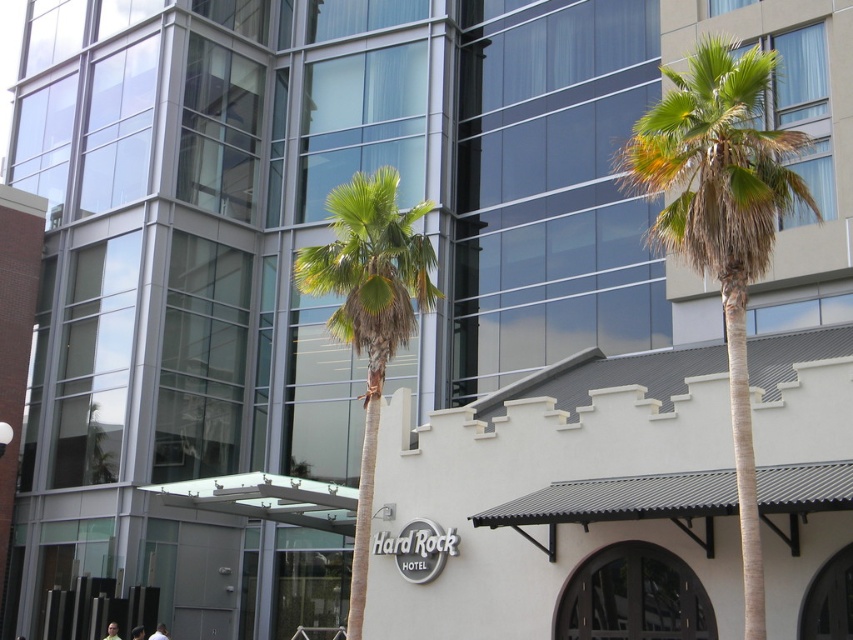
You are standing in front of the modern glass building and want to walk towards the green leafy palm tree at center. However, there is another green leafy palm tree at right in your path. Which palm tree will you encounter first?

The green leafy palm tree at right is closer to the viewer than the green leafy palm tree at center, so you will encounter the green leafy palm tree at right first before reaching the one at center.

You are a visitor to this modern architectural site and want to take a photo that includes both the green leafy palm tree at right and the green leafy palm tree at center. Which palm tree appears higher in the photo?

The green leafy palm tree at right appears higher in the photo because it is positioned above the green leafy palm tree at center.

You are a landscape architect planning to add more palm trees to the scene. Given the current spacing between the green leafy palm tree at right and the green leafy palm tree at center, would you recommend placing a new palm tree between them? Explain your reasoning based on their sizes.

The green leafy palm tree at right is narrower than the green leafy palm tree at center. Since the tree at the center is wider, there might be limited space between them for a new palm tree. Consider measuring the distance and ensuring adequate space for growth before deciding.